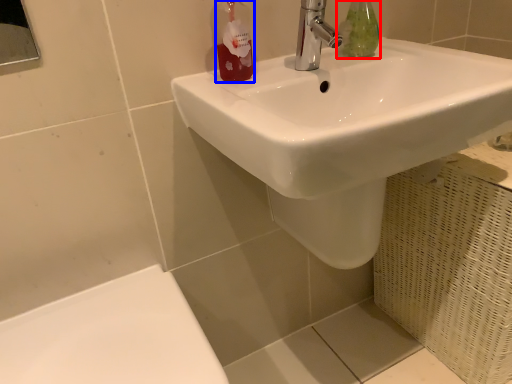
Question: Among these objects, which one is farthest to the camera, mouthwash (highlighted by a red box) or toiletry (highlighted by a blue box)?

Choices:
 (A) mouthwash
 (B) toiletry

Answer: (A)